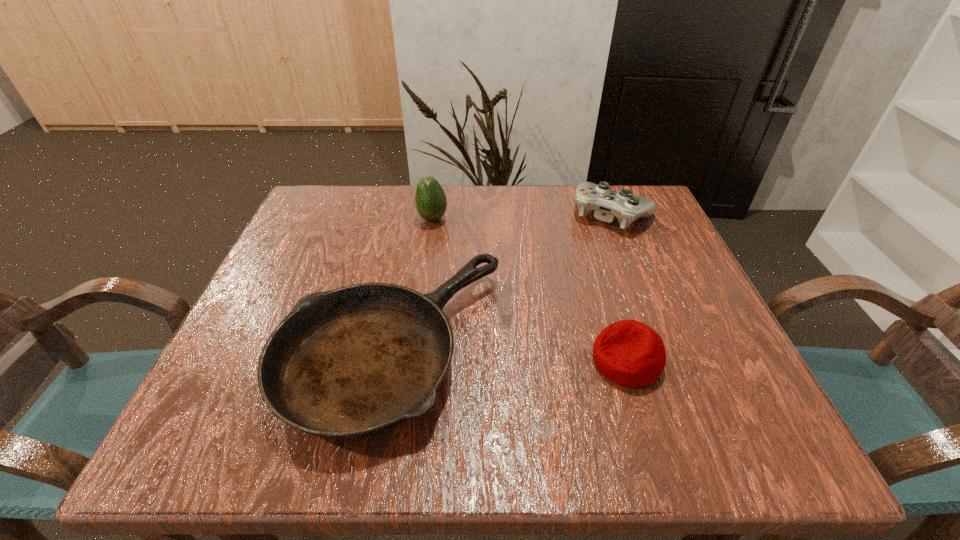
Locate an element on the screen. vacant space at the left edge of the desktop is located at coordinates (319, 262).

The image size is (960, 540). In order to click on vacant space at the right edge in this screenshot , I will do `click(708, 301)`.

The width and height of the screenshot is (960, 540). In order to click on vacant position at the far left corner of the desktop in this screenshot , I will do `click(330, 187)`.

The width and height of the screenshot is (960, 540). In the image, there is a desktop. Find the location of `vacant space at the far right corner`. vacant space at the far right corner is located at coordinates (657, 205).

At what (x,y) coordinates should I click in order to perform the action: click on free spot between the control and the second shortest object. Please return your answer as a coordinate pair (x, y). This screenshot has height=540, width=960. Looking at the image, I should click on click(x=619, y=287).

The width and height of the screenshot is (960, 540). What are the coordinates of `vacant point located between the third tallest object and the frying pan` in the screenshot? It's located at (509, 354).

I want to click on free space between the beanbag and the control, so pos(619,287).

Where is `free point between the beanbag and the tallest object`? This screenshot has height=540, width=960. free point between the beanbag and the tallest object is located at coordinates click(x=530, y=289).

This screenshot has height=540, width=960. In order to click on empty space between the frying pan and the control in this screenshot , I will do `click(502, 280)`.

The image size is (960, 540). I want to click on vacant area between the third tallest object and the avocado, so click(x=530, y=289).